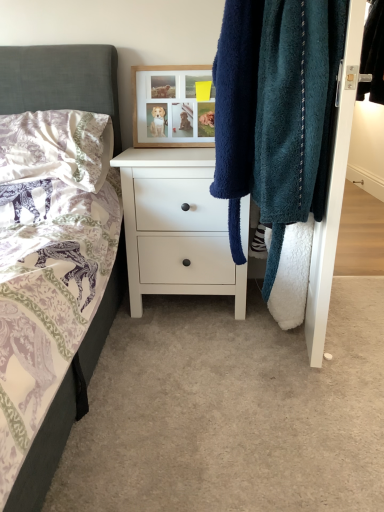
Question: From the image's perspective, is wooden picture frame at upper center beneath teal fuzzy towel at right?

Choices:
 (A) yes
 (B) no

Answer: (B)

Question: From a real-world perspective, is wooden picture frame at upper center beneath teal fuzzy towel at right?

Choices:
 (A) no
 (B) yes

Answer: (A)

Question: Is wooden picture frame at upper center further to camera compared to teal fuzzy towel at right?

Choices:
 (A) no
 (B) yes

Answer: (B)

Question: Is wooden picture frame at upper center located outside teal fuzzy towel at right?

Choices:
 (A) no
 (B) yes

Answer: (B)

Question: Is wooden picture frame at upper center taller than teal fuzzy towel at right?

Choices:
 (A) yes
 (B) no

Answer: (B)

Question: Considering the positions of white textured pillow at upper left and black leather jacket at upper right in the image, is white textured pillow at upper left bigger or smaller than black leather jacket at upper right?

Choices:
 (A) small
 (B) big

Answer: (B)

Question: From the image's perspective, is white textured pillow at upper left above or below black leather jacket at upper right?

Choices:
 (A) below
 (B) above

Answer: (A)

Question: Considering the positions of white textured pillow at upper left and black leather jacket at upper right in the image, is white textured pillow at upper left taller or shorter than black leather jacket at upper right?

Choices:
 (A) tall
 (B) short

Answer: (B)

Question: Is point (92, 189) closer or farther from the camera than point (374, 92)?

Choices:
 (A) closer
 (B) farther

Answer: (B)

Question: From the image's perspective, relative to white matte chest of drawers at center, is wooden picture frame at upper center above or below?

Choices:
 (A) below
 (B) above

Answer: (B)

Question: Is wooden picture frame at upper center wider or thinner than white matte chest of drawers at center?

Choices:
 (A) wide
 (B) thin

Answer: (B)

Question: From a real-world perspective, relative to white matte chest of drawers at center, is wooden picture frame at upper center vertically above or below?

Choices:
 (A) below
 (B) above

Answer: (B)

Question: Is wooden picture frame at upper center taller or shorter than white matte chest of drawers at center?

Choices:
 (A) tall
 (B) short

Answer: (B)

Question: Does point tap(150, 116) appear closer or farther from the camera than point tap(332, 231)?

Choices:
 (A) farther
 (B) closer

Answer: (A)

Question: Considering the positions of wooden picture frame at upper center and teal fuzzy towel at right in the image, is wooden picture frame at upper center wider or thinner than teal fuzzy towel at right?

Choices:
 (A) wide
 (B) thin

Answer: (B)